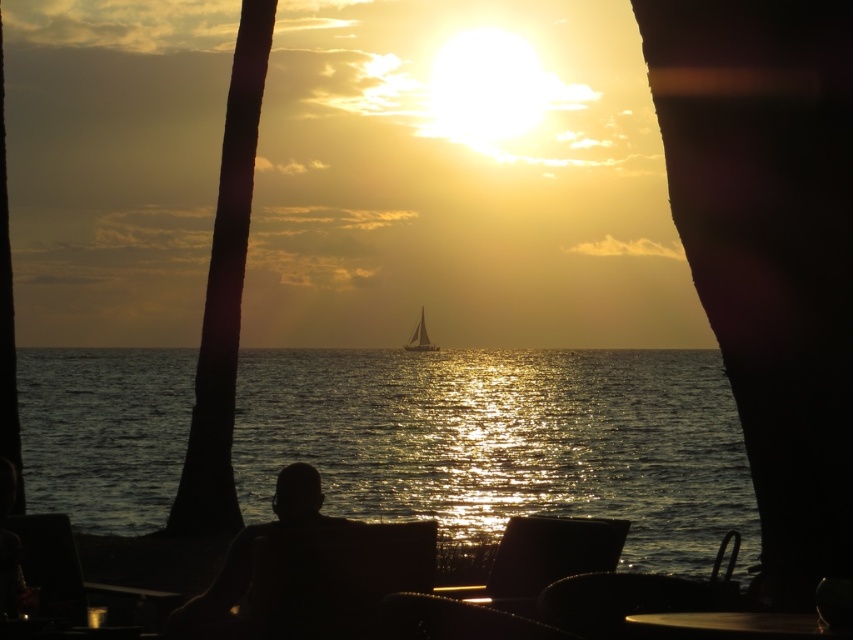
Is point (267, 428) farther from viewer compared to point (244, 81)?

Yes, point (267, 428) is farther from viewer.

Between point (511, 467) and point (209, 326), which one is positioned behind?

Positioned behind is point (511, 467).

Find the location of a particular element. The width and height of the screenshot is (853, 640). glistening water at center is located at coordinates (506, 442).

Does point (222, 492) lie behind point (300, 621)?

Yes, point (222, 492) is farther from viewer.

Does point (202, 358) come behind point (422, 579)?

Yes, point (202, 358) is behind point (422, 579).

You are a GUI agent. You are given a task and a screenshot of the screen. Output one action in this format:
    pyautogui.click(x=<x>, y=<y>)
    Task: Click on the silhouette wood palm tree at left
    This screenshot has height=640, width=853.
    Given the screenshot: What is the action you would take?
    pyautogui.click(x=224, y=296)

Where is `silhouette wood palm tree at left`? Image resolution: width=853 pixels, height=640 pixels. silhouette wood palm tree at left is located at coordinates (224, 296).

Can you confirm if silhouette wood palm tree at left is positioned below silvery reflective sailboat at center?

No, silhouette wood palm tree at left is not below silvery reflective sailboat at center.

Find the location of a particular element. silhouette wood palm tree at left is located at coordinates (224, 296).

What are the coordinates of `silhouette wood palm tree at left` in the screenshot? It's located at (224, 296).